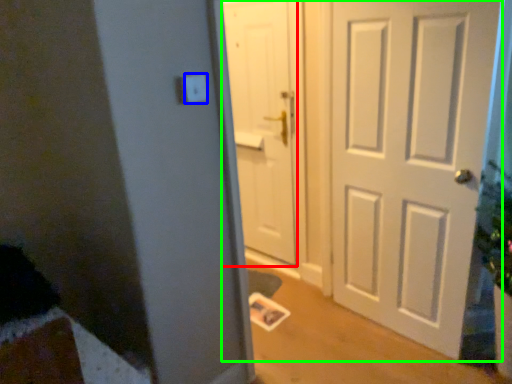
Question: Based on their relative distances, which object is farther from door (highlighted by a red box)? Choose from light switch (highlighted by a blue box) and door (highlighted by a green box).

Choices:
 (A) light switch
 (B) door

Answer: (A)